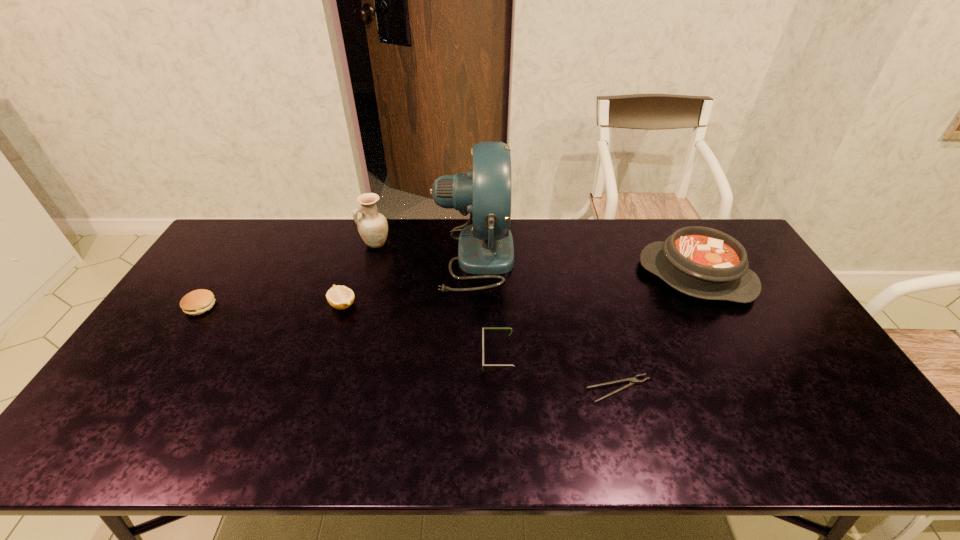
The height and width of the screenshot is (540, 960). Identify the location of casserole positioned at the far edge. (702, 262).

At what (x,y) coordinates should I click in order to perform the action: click on object located in the left edge section of the desktop. Please return your answer as a coordinate pair (x, y). Looking at the image, I should click on pos(196,302).

In order to click on object present at the right edge in this screenshot , I will do `click(702, 262)`.

Where is `object that is at the far right corner`? The height and width of the screenshot is (540, 960). object that is at the far right corner is located at coordinates (702, 262).

What are the coordinates of `vacant area at the far edge of the desktop` in the screenshot? It's located at (554, 219).

In the image, there is a desktop. Where is `vacant space at the near edge`? The height and width of the screenshot is (540, 960). vacant space at the near edge is located at coordinates (524, 443).

In the image, there is a desktop. At what (x,y) coordinates should I click in order to perform the action: click on free region at the left edge. Please return your answer as a coordinate pair (x, y). Looking at the image, I should click on (109, 417).

This screenshot has height=540, width=960. In order to click on vacant space at the far left corner of the desktop in this screenshot , I will do `click(247, 247)`.

This screenshot has width=960, height=540. Identify the location of vacant space at the near left corner of the desktop. (112, 434).

The width and height of the screenshot is (960, 540). What are the coordinates of `free area in between the tongs and the fan` in the screenshot? It's located at (546, 322).